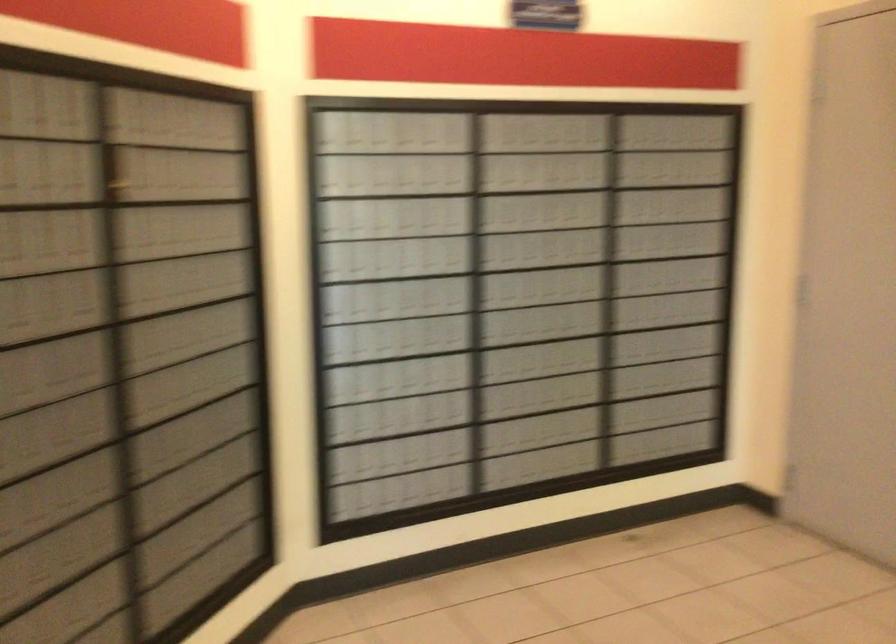
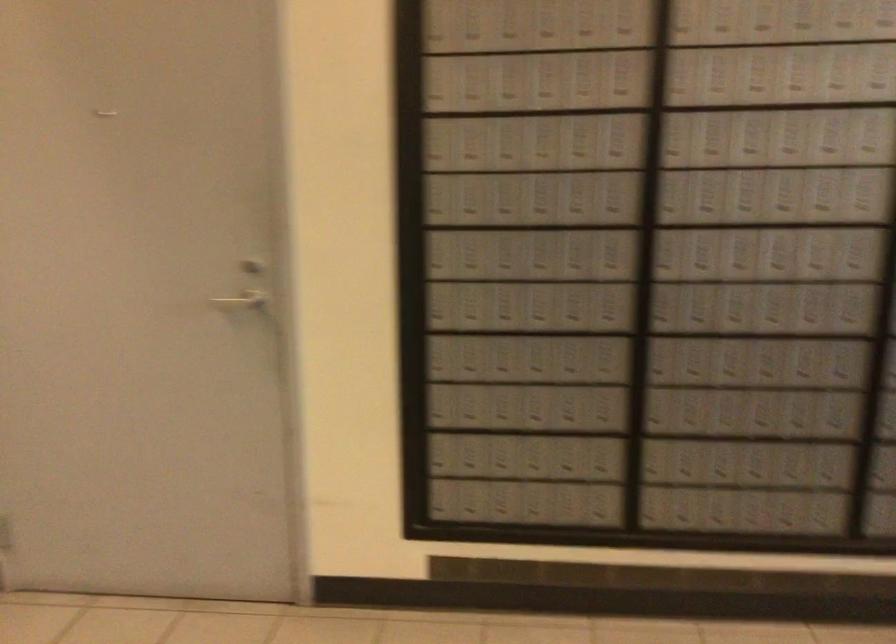
Question: The camera is either moving clockwise (left) or counter-clockwise (right) around the object. The first image is from the beginning of the video and the second image is from the end. Is the camera moving left or right when shooting the video?

Choices:
 (A) Left
 (B) Right

Answer: (A)